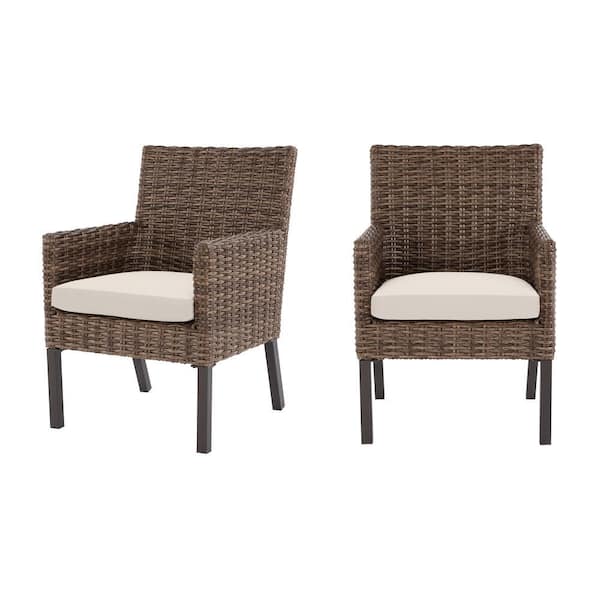
At what (x,y) coordinates should I click in order to perform the action: click on front of chairs. Please return your answer as a coordinate pair (x, y). The height and width of the screenshot is (600, 600). Looking at the image, I should click on (449, 340), (109, 337).